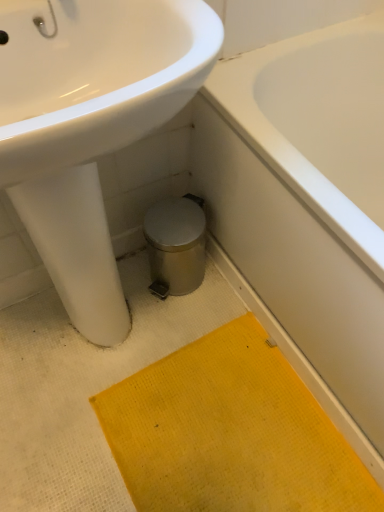
Question: Considering the relative sizes of white glossy sink at upper left and white glossy bathtub at lower right in the image provided, is white glossy sink at upper left smaller than white glossy bathtub at lower right?

Choices:
 (A) yes
 (B) no

Answer: (A)

Question: Are white glossy sink at upper left and white glossy bathtub at lower right making contact?

Choices:
 (A) yes
 (B) no

Answer: (B)

Question: Is white glossy sink at upper left aimed at white glossy bathtub at lower right?

Choices:
 (A) no
 (B) yes

Answer: (A)

Question: Is white glossy sink at upper left looking in the opposite direction of white glossy bathtub at lower right?

Choices:
 (A) no
 (B) yes

Answer: (A)

Question: From a real-world perspective, is white glossy sink at upper left located beneath white glossy bathtub at lower right?

Choices:
 (A) yes
 (B) no

Answer: (B)

Question: Does white glossy sink at upper left appear on the left side of white glossy bathtub at lower right?

Choices:
 (A) yes
 (B) no

Answer: (A)

Question: Considering the relative positions of white glossy bathtub at lower right and yellow textured bath mat at lower center in the image provided, is white glossy bathtub at lower right to the right of yellow textured bath mat at lower center from the viewer's perspective?

Choices:
 (A) no
 (B) yes

Answer: (B)

Question: Does white glossy bathtub at lower right have a larger size compared to yellow textured bath mat at lower center?

Choices:
 (A) yes
 (B) no

Answer: (A)

Question: Is white glossy bathtub at lower right touching yellow textured bath mat at lower center?

Choices:
 (A) no
 (B) yes

Answer: (A)

Question: Does white glossy bathtub at lower right have a lesser width compared to yellow textured bath mat at lower center?

Choices:
 (A) yes
 (B) no

Answer: (B)

Question: From the image's perspective, is white glossy bathtub at lower right beneath yellow textured bath mat at lower center?

Choices:
 (A) no
 (B) yes

Answer: (A)

Question: From the image's perspective, does white glossy bathtub at lower right appear higher than yellow textured bath mat at lower center?

Choices:
 (A) yes
 (B) no

Answer: (A)

Question: From a real-world perspective, is yellow textured bath mat at lower center below white glossy bathtub at lower right?

Choices:
 (A) yes
 (B) no

Answer: (A)